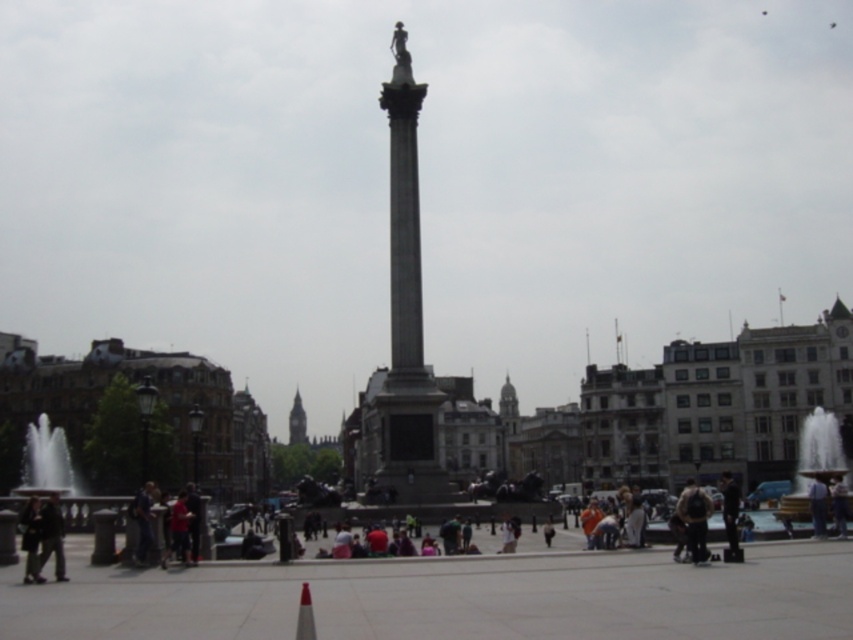
Which is more to the right, brown leather jacket at lower right or smooth stone tower at upper center?

Positioned to the right is brown leather jacket at lower right.

Is brown leather jacket at lower right wider than smooth stone tower at upper center?

Yes, brown leather jacket at lower right is wider than smooth stone tower at upper center.

Between point (683, 486) and point (514, 401), which one is positioned in front?

Point (683, 486) is in front.

In order to click on brown leather jacket at lower right in this screenshot , I will do `click(694, 518)`.

This screenshot has height=640, width=853. What do you see at coordinates (405, 316) in the screenshot?
I see `gray stone column at center` at bounding box center [405, 316].

Between gray stone column at center and gold metallic fountain at lower right, which one has less height?

gold metallic fountain at lower right

This screenshot has width=853, height=640. In order to click on gray stone column at center in this screenshot , I will do `click(405, 316)`.

Can you confirm if brown leather jacket at lower right is wider than red plastic cone at lower center?

Yes.

Is brown leather jacket at lower right positioned before red plastic cone at lower center?

No, it is not.

Describe the element at coordinates (694, 518) in the screenshot. The width and height of the screenshot is (853, 640). I see `brown leather jacket at lower right` at that location.

Where is `brown leather jacket at lower right`? brown leather jacket at lower right is located at coordinates (694, 518).